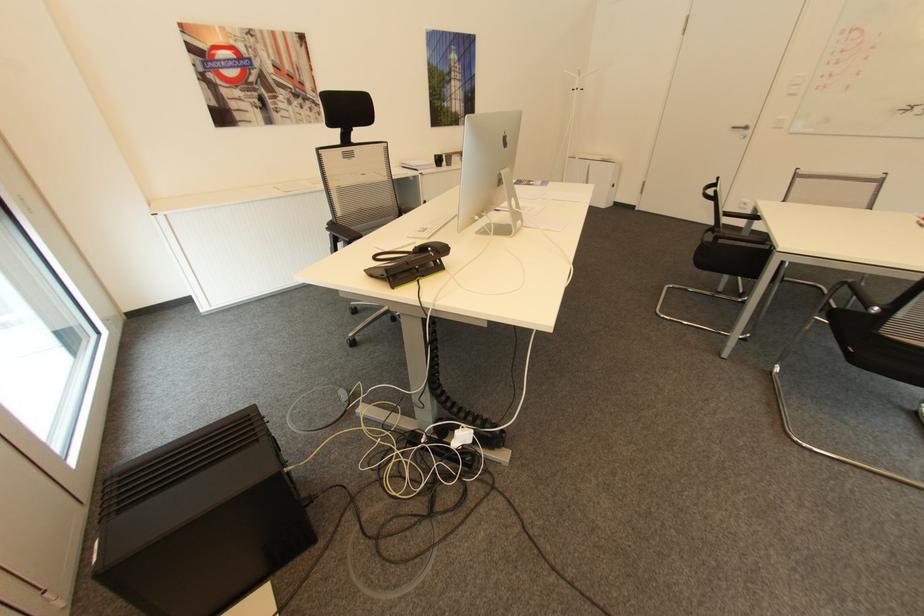
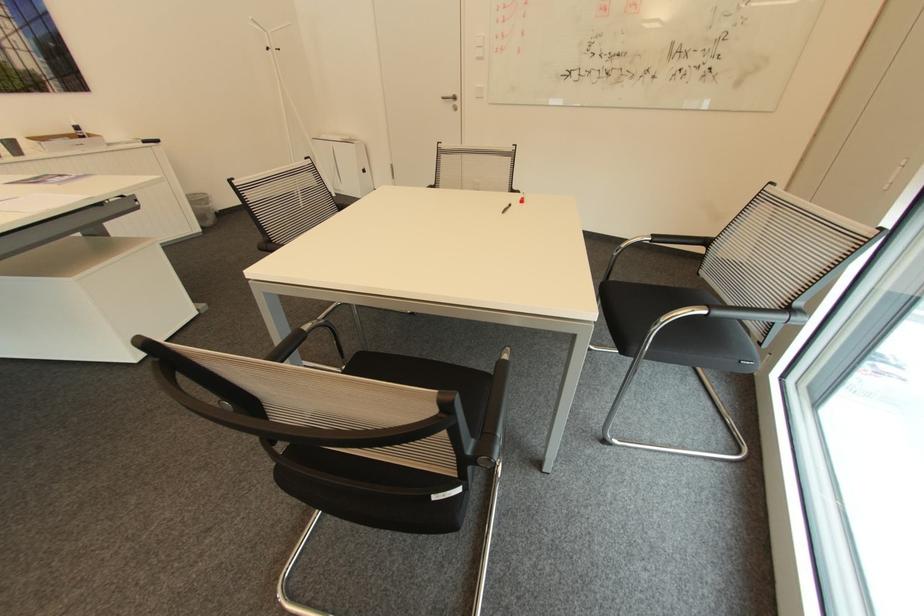
In the second image, find the point that corresponds to pixel 617 185 in the first image.

(369, 171)